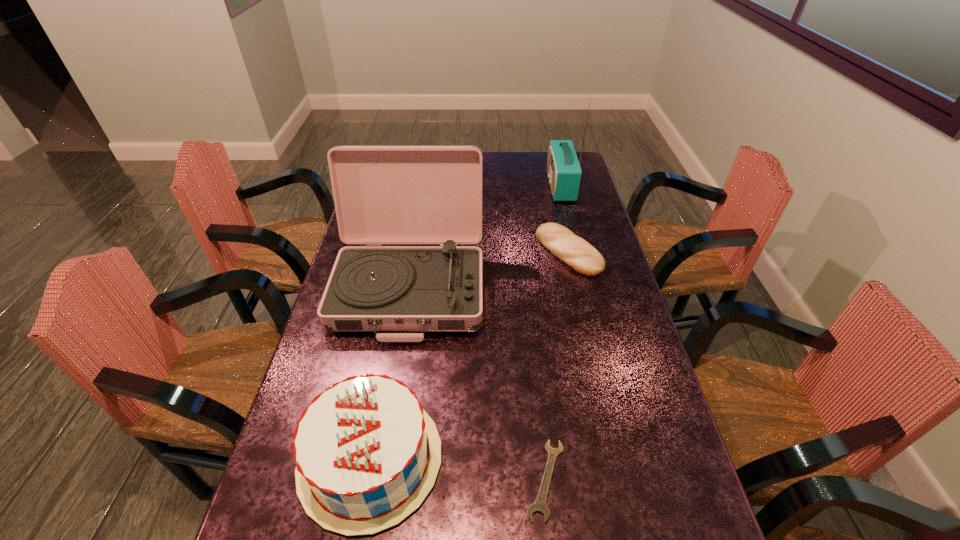
Find the location of a particular element. the farthest object is located at coordinates (564, 172).

Identify the location of record player. (382, 194).

Find the location of a particular element. This screenshot has height=540, width=960. birthday cake is located at coordinates (367, 454).

At what (x,y) coordinates should I click in order to perform the action: click on bread. Please return your answer as a coordinate pair (x, y). Image resolution: width=960 pixels, height=540 pixels. Looking at the image, I should click on (573, 250).

You are a GUI agent. You are given a task and a screenshot of the screen. Output one action in this format:
    pyautogui.click(x=<x>, y=<y>)
    Task: Click on the shortest object
    This screenshot has width=960, height=540.
    Given the screenshot: What is the action you would take?
    pyautogui.click(x=539, y=505)

Find the location of a particular element. This screenshot has height=540, width=960. wrench is located at coordinates (539, 505).

You are a GUI agent. You are given a task and a screenshot of the screen. Output one action in this format:
    pyautogui.click(x=<x>, y=<y>)
    Task: Click on the vacant space positioned 0.380m on the front panel of the radio receiver
    
    Given the screenshot: What is the action you would take?
    pyautogui.click(x=454, y=186)

You are a GUI agent. You are given a task and a screenshot of the screen. Output one action in this format:
    pyautogui.click(x=<x>, y=<y>)
    Task: Click on the free point located on the front panel of the radio receiver
    Image resolution: width=960 pixels, height=540 pixels.
    Given the screenshot: What is the action you would take?
    pyautogui.click(x=476, y=186)

Image resolution: width=960 pixels, height=540 pixels. I want to click on free location located on the front panel of the radio receiver, so click(x=454, y=186).

This screenshot has width=960, height=540. Identify the location of free space located with the lid open on the record player. (379, 480).